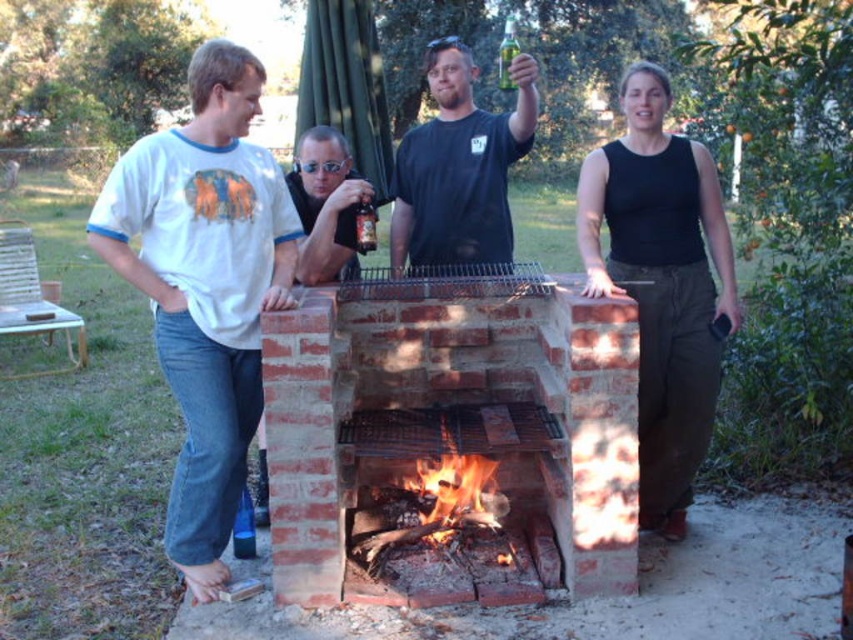
Question: Which of the following is the farthest from the observer?

Choices:
 (A) (221, 60)
 (B) (508, 51)
 (C) (201, 83)
 (D) (401, 243)

Answer: (D)

Question: Is the position of matte white t-shirt at upper left less distant than that of black matte t-shirt at center?

Choices:
 (A) yes
 (B) no

Answer: (A)

Question: Is black sleeveless top at right bigger than brown glass bottle at center?

Choices:
 (A) no
 (B) yes

Answer: (B)

Question: Can you confirm if white t-shirt at left is bigger than matte white t-shirt at upper left?

Choices:
 (A) yes
 (B) no

Answer: (A)

Question: Which object is the closest to the brown glass bottle at center?

Choices:
 (A) white t-shirt at left
 (B) matte white t-shirt at upper left
 (C) black matte t-shirt at center
 (D) flaming wood at center

Answer: (C)

Question: Which of the following is the farthest from the observer?

Choices:
 (A) (583, 236)
 (B) (498, 557)
 (C) (505, 72)
 (D) (263, 202)

Answer: (C)